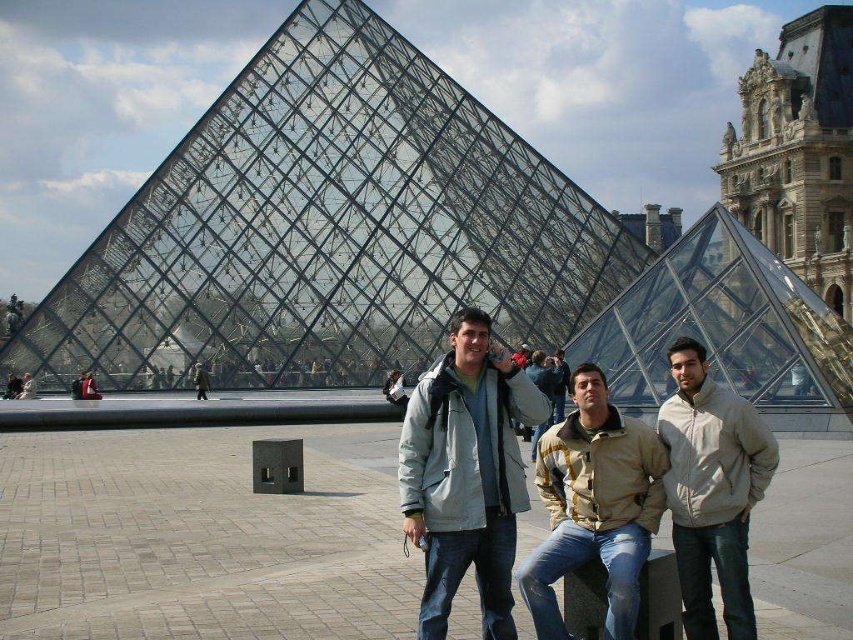
Question: Among these points, which one is farthest from the camera?

Choices:
 (A) (676, 410)
 (B) (428, 502)
 (C) (607, 636)

Answer: (A)

Question: Which of the following is the closest to the observer?

Choices:
 (A) light gray jacket at center
 (B) transparent glass pyramid at center

Answer: (A)

Question: Can you confirm if light gray jacket at center is thinner than beige fabric jacket at center?

Choices:
 (A) yes
 (B) no

Answer: (B)

Question: Estimate the real-world distances between objects in this image. Which object is farther from the beige fabric jacket at center?

Choices:
 (A) transparent glass pyramid at center
 (B) beige fleece jacket at center
 (C) light gray jacket at center

Answer: (A)

Question: Does light gray jacket at center appear on the left side of beige fleece jacket at center?

Choices:
 (A) yes
 (B) no

Answer: (A)

Question: Is the position of light gray jacket at center less distant than that of beige fabric jacket at center?

Choices:
 (A) no
 (B) yes

Answer: (A)